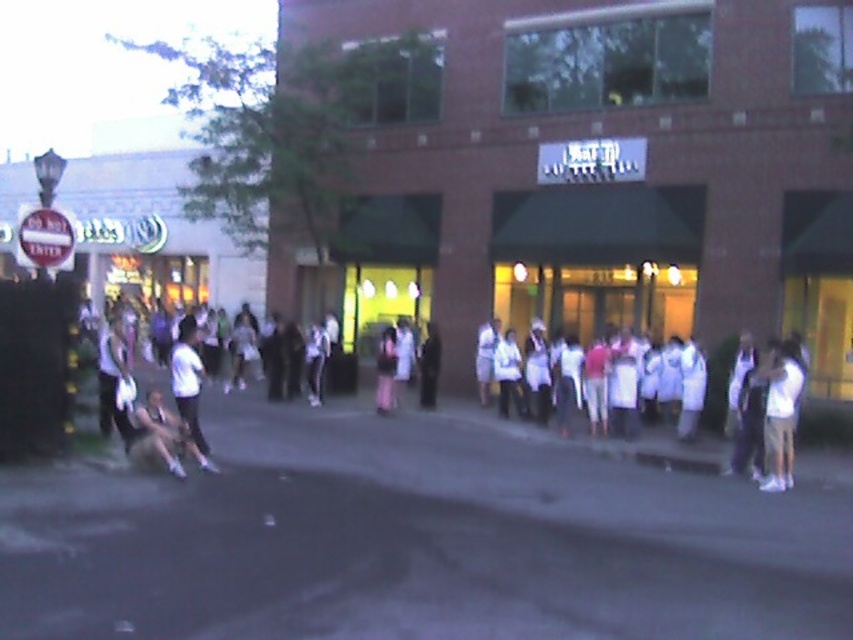
Is the position of white cotton shirt at right less distant than that of white athletic wear at lower left?

No, it is not.

Is point (782, 440) farther from viewer compared to point (175, 432)?

Yes, point (782, 440) is farther from viewer.

At what (x,y) coordinates should I click in order to perform the action: click on white cotton shirt at right. Please return your answer as a coordinate pair (x, y). The image size is (853, 640). Looking at the image, I should click on (781, 417).

Between point (698, 472) and point (428, 385), which one is positioned behind?

The point (428, 385) is behind.

Who is lower down, white cloth at center or dark clothing at center?

white cloth at center

I want to click on white cloth at center, so click(x=654, y=451).

Who is taller, white matte shirt at center or dark clothing at center?

white matte shirt at center

Between point (199, 392) and point (434, 349), which one is positioned in front?

Positioned in front is point (199, 392).

Which is in front, point (178, 364) or point (430, 401)?

Point (178, 364)

Locate an element on the screen. white matte shirt at center is located at coordinates (187, 380).